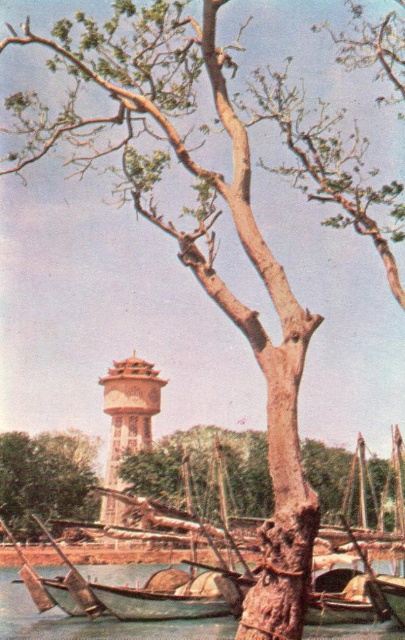
Is green rough bark tree at lower left above brown textured water tower at center?

Actually, green rough bark tree at lower left is below brown textured water tower at center.

Measure the distance between green rough bark tree at lower left and camera.

green rough bark tree at lower left and camera are 144.42 meters apart from each other.

Find the location of a particular element. Image resolution: width=405 pixels, height=640 pixels. green rough bark tree at lower left is located at coordinates (46, 477).

Does brown rough tree trunk at center have a lesser width compared to green rough bark tree at lower left?

No.

Between brown rough tree trunk at center and green rough bark tree at lower left, which one appears on the right side from the viewer's perspective?

brown rough tree trunk at center is more to the right.

Which is behind, point (149, 492) or point (46, 518)?

Positioned behind is point (46, 518).

What are the coordinates of `brown rough tree trunk at center` in the screenshot? It's located at (204, 470).

Does wooden boat at lower center have a lesser width compared to wooden canoe at lower left?

No.

Is wooden boat at lower center shorter than wooden canoe at lower left?

Correct, wooden boat at lower center is not as tall as wooden canoe at lower left.

Which is behind, point (14, 630) or point (202, 616)?

Positioned behind is point (14, 630).

What are the coordinates of `wooden boat at lower center` in the screenshot? It's located at (91, 621).